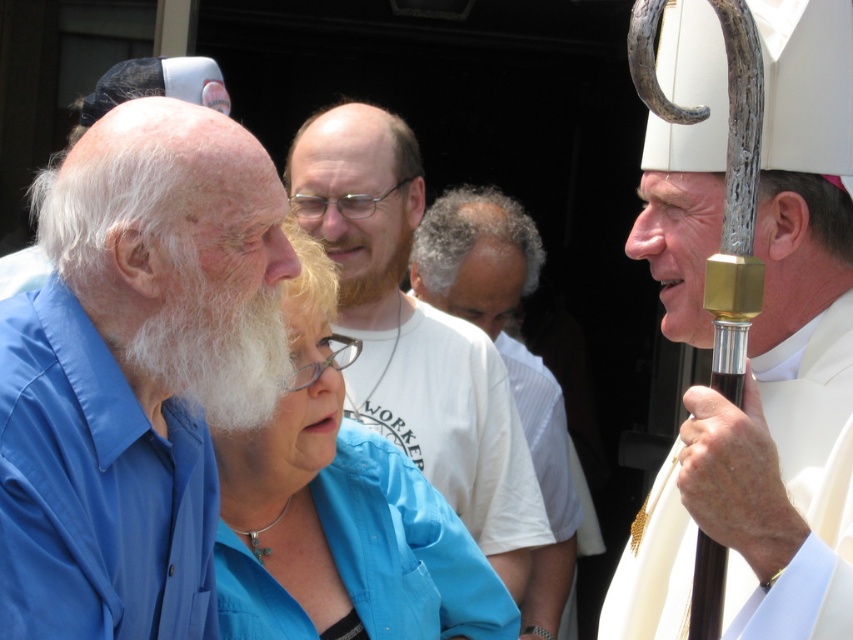
Measure the distance from white matte staff at center to blue fabric shirt at center.

white matte staff at center is 37.77 inches away from blue fabric shirt at center.

Between point (822, 282) and point (334, 484), which one is positioned behind?

Point (334, 484)

Is point (776, 177) positioned after point (310, 394)?

No, (776, 177) is closer to viewer.

Identify the location of white matte staff at center. (x=770, y=381).

How much distance is there between blue cotton shirt at left and white cotton shirt at center?

The distance of blue cotton shirt at left from white cotton shirt at center is 2.38 meters.

Is point (106, 541) closer to viewer compared to point (456, 228)?

That is True.

Is point (221, 326) positioned in front of point (550, 438)?

Yes, it is in front of point (550, 438).

You are a GUI agent. You are given a task and a screenshot of the screen. Output one action in this format:
    pyautogui.click(x=<x>, y=<y>)
    Task: Click on the blue cotton shirt at left
    The width and height of the screenshot is (853, 640).
    Given the screenshot: What is the action you would take?
    pyautogui.click(x=135, y=372)

Who is lower down, blue fabric shirt at center or white fluffy beard at left?

blue fabric shirt at center is below.

Between point (339, 497) and point (196, 372), which one is positioned behind?

Positioned behind is point (339, 497).

Find the location of `blue fabric shirt at center`. blue fabric shirt at center is located at coordinates [x=339, y=512].